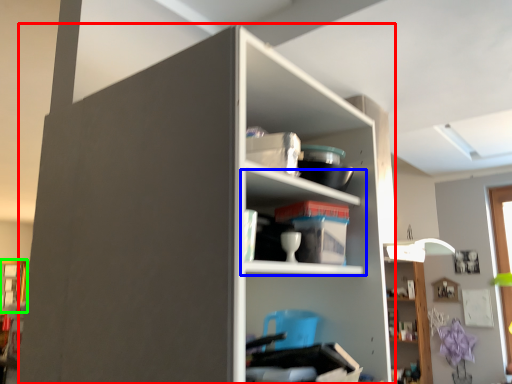
Question: Considering the real-world distances, which object is farthest from shelf (highlighted by a red box)? shelf (highlighted by a blue box) or window (highlighted by a green box)?

Choices:
 (A) shelf
 (B) window

Answer: (B)